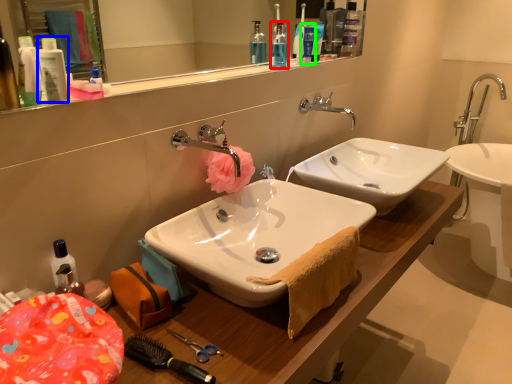
Question: Which is nearer to the mouthwash (highlighted by a red box)? toiletry (highlighted by a blue box) or toiletry (highlighted by a green box).

Choices:
 (A) toiletry
 (B) toiletry

Answer: (B)